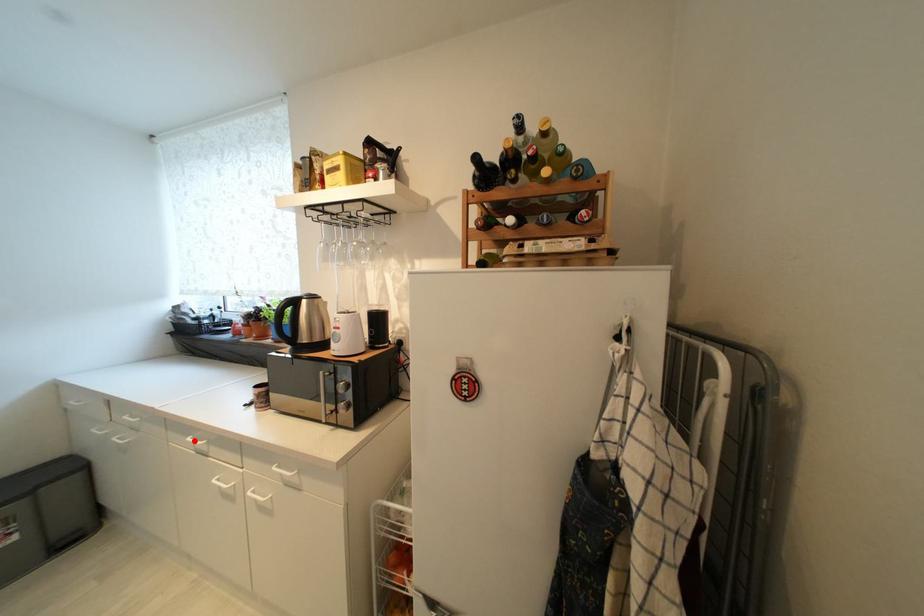
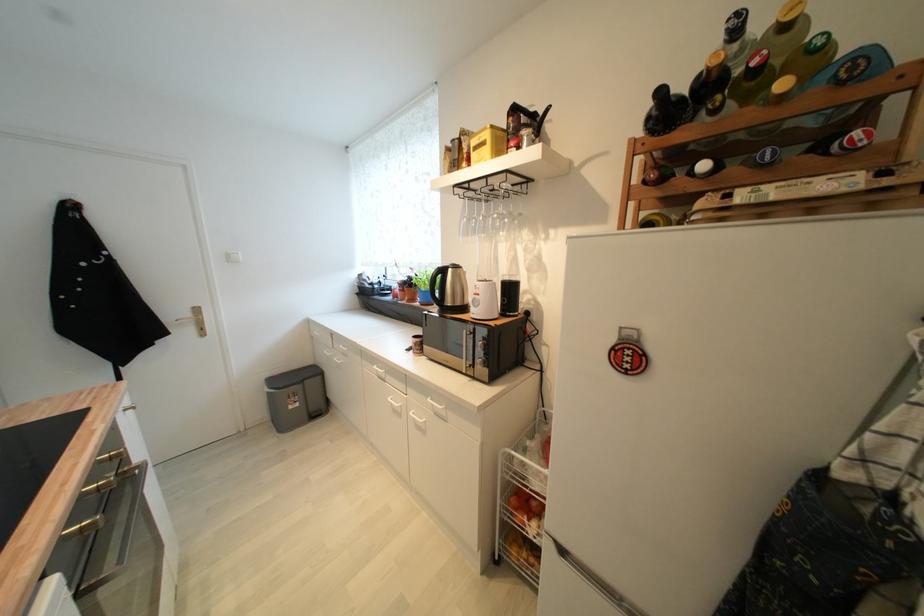
Question: I am providing you with two images of the same scene from different viewpoints. A red point is marked on the first image. At the location where the point appears in image 1, is it still visible in image 2?

Choices:
 (A) Yes
 (B) No

Answer: (A)